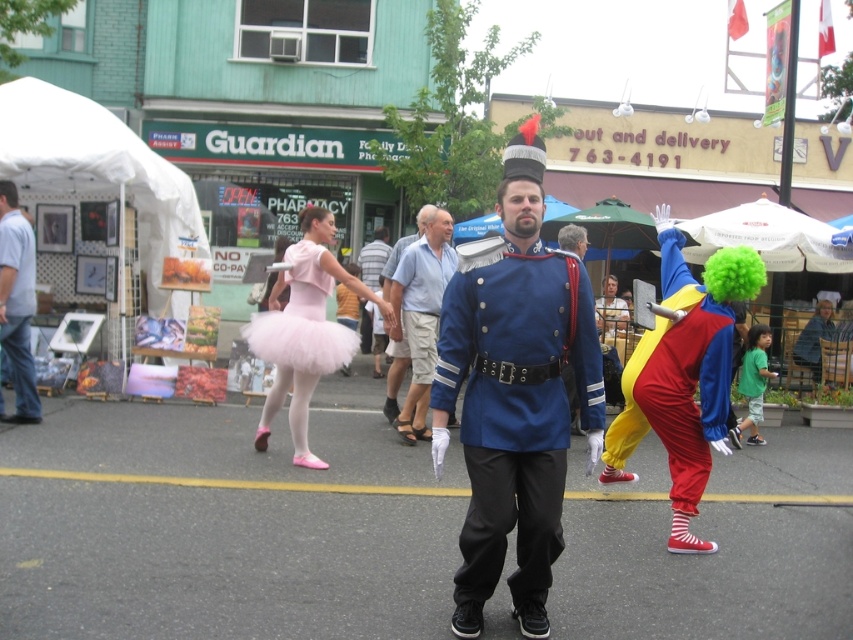
Is shiny blue uniform at center taller than blue uniform at center?

Yes, shiny blue uniform at center is taller than blue uniform at center.

Between shiny blue uniform at center and blue uniform at center, which one appears on the left side from the viewer's perspective?

blue uniform at center

Between point (560, 513) and point (440, 220), which one is positioned in front?

Point (560, 513)

I want to click on shiny blue uniform at center, so click(514, 392).

Which is above, matte pink tutu at center or light blue cotton shirt at left?

light blue cotton shirt at left is above.

Looking at this image, who is shorter, matte pink tutu at center or light blue cotton shirt at left?

light blue cotton shirt at left

Which is in front, point (671, 483) or point (21, 348)?

Point (671, 483) is more forward.

What are the coordinates of `matte pink tutu at center` in the screenshot? It's located at (683, 376).

Is point (544, 284) farther from camera compared to point (666, 256)?

No, (544, 284) is closer to viewer.

Can you confirm if shiny blue uniform at center is taller than matte pink tutu at center?

Yes, shiny blue uniform at center is taller than matte pink tutu at center.

The image size is (853, 640). What do you see at coordinates (514, 392) in the screenshot?
I see `shiny blue uniform at center` at bounding box center [514, 392].

Where is `shiny blue uniform at center`? This screenshot has width=853, height=640. shiny blue uniform at center is located at coordinates (514, 392).